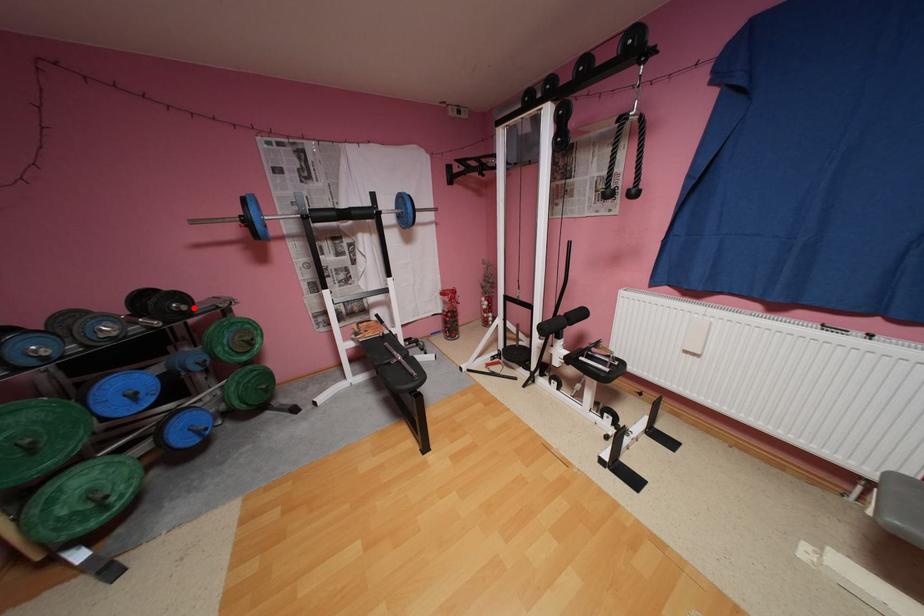
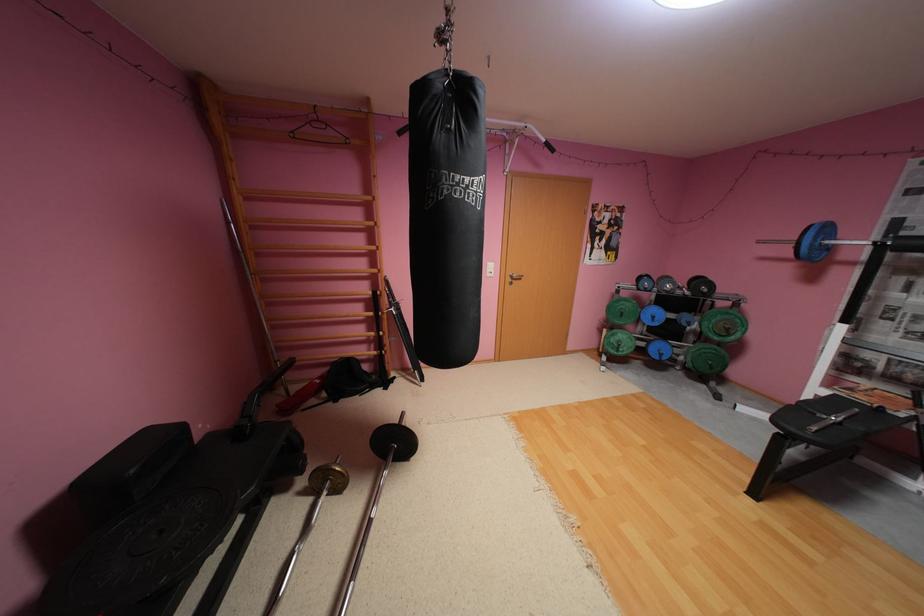
Question: I am providing you with two images of the same scene from different viewpoints. A red point is marked on the first image. Can you still see the location of the red point in image 2?

Choices:
 (A) Yes
 (B) No

Answer: (A)